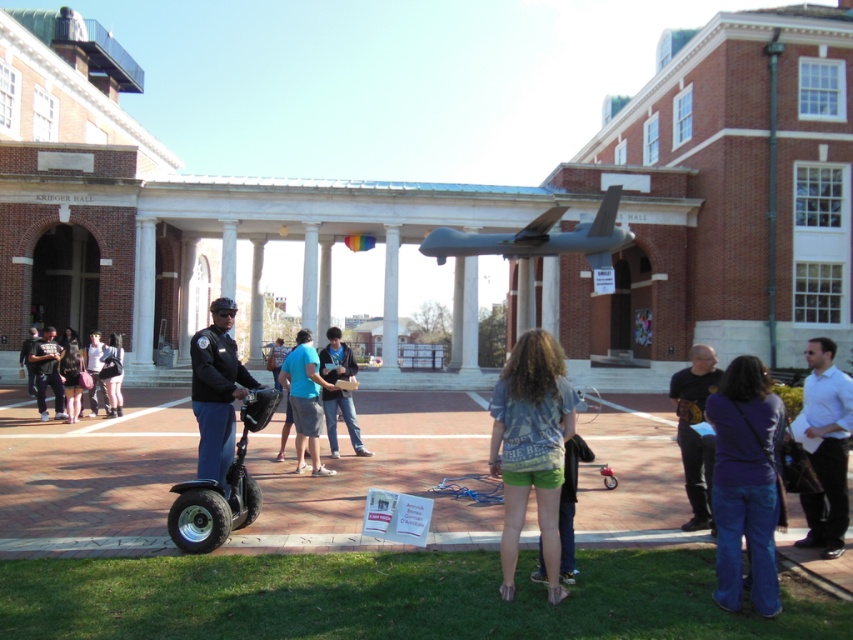
You are standing at the point labeled point (53, 356) and want to walk to the point labeled point (698, 500). Which direction should you move to get closer to your destination?

To move from point (53, 356) to point (698, 500), you should move towards the upper right direction since point (698, 500) is located in that direction relative to point (53, 356).

You are standing at the point marked as point (221, 490) in the image. What object are you currently standing on?

You are standing on the black rubber segway at center.